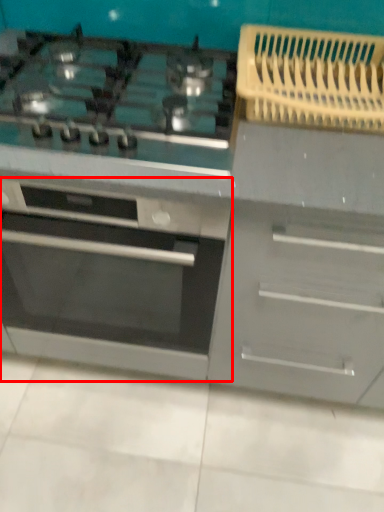
Question: From the image's perspective, what is the correct spatial relationship of oven (annotated by the red box) in relation to gas stove?

Choices:
 (A) above
 (B) below

Answer: (B)